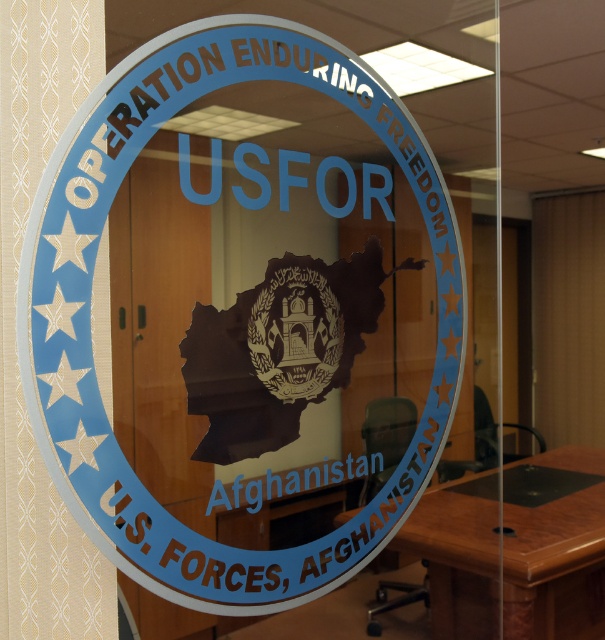
You are standing in front of the glass door and see two points marked on the emblem. The first point is at coordinate point (x=347, y=51) and the second is at point (x=194, y=333). Which point is closer to you?

Point (x=347, y=51) is behind point (x=194, y=333), so the point closer to you is point (x=194, y=333).

You are a visitor standing in front of the glass door and see the brown wooden table at lower right and the brown textured emblem at center. Which object is taller?

The brown wooden table at lower right is taller than the brown textured emblem at center.